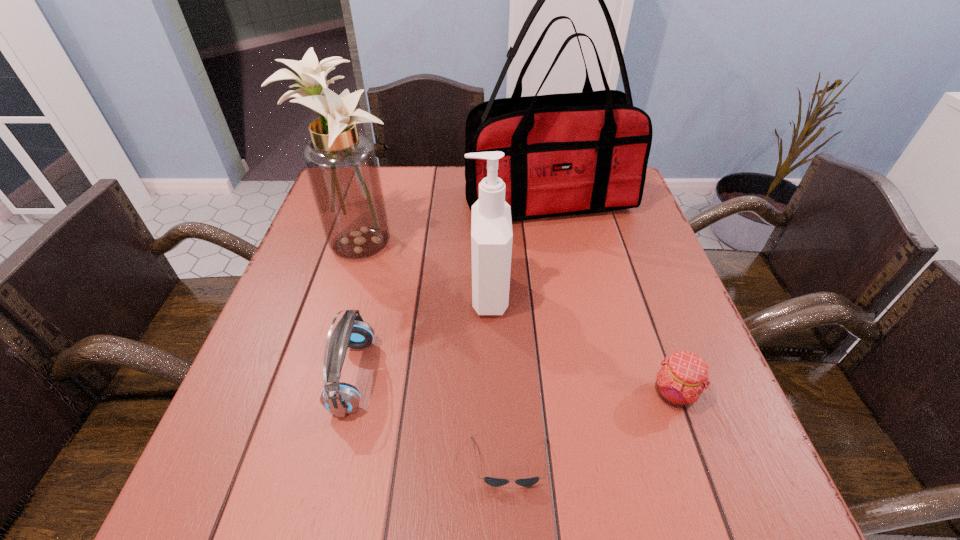
You are a GUI agent. You are given a task and a screenshot of the screen. Output one action in this format:
    pyautogui.click(x=<x>, y=<y>)
    Task: Click on the duffel bag
    
    Given the screenshot: What is the action you would take?
    pyautogui.click(x=565, y=154)

Identify the location of the second tallest object. The image size is (960, 540). (341, 164).

At what (x,y) coordinates should I click in order to perform the action: click on the fourth shortest object. Please return your answer as a coordinate pair (x, y). Looking at the image, I should click on (491, 226).

You are a GUI agent. You are given a task and a screenshot of the screen. Output one action in this format:
    pyautogui.click(x=<x>, y=<y>)
    Task: Click on the fourth tallest object
    
    Given the screenshot: What is the action you would take?
    pyautogui.click(x=339, y=398)

Find the location of a particular element. The image size is (960, 540). jam is located at coordinates (683, 376).

Image resolution: width=960 pixels, height=540 pixels. Find the location of `the shortest object`. the shortest object is located at coordinates (495, 482).

In order to click on sunglasses in this screenshot , I will do `click(495, 482)`.

This screenshot has height=540, width=960. I want to click on vacant space located 0.350m on the front of the tallest object, so click(x=577, y=337).

Locate an element on the screen. free location located on the back of the fifth shortest object is located at coordinates (376, 182).

This screenshot has height=540, width=960. Find the location of `vacant space situated on the front label of the cleansing agent`. vacant space situated on the front label of the cleansing agent is located at coordinates (442, 294).